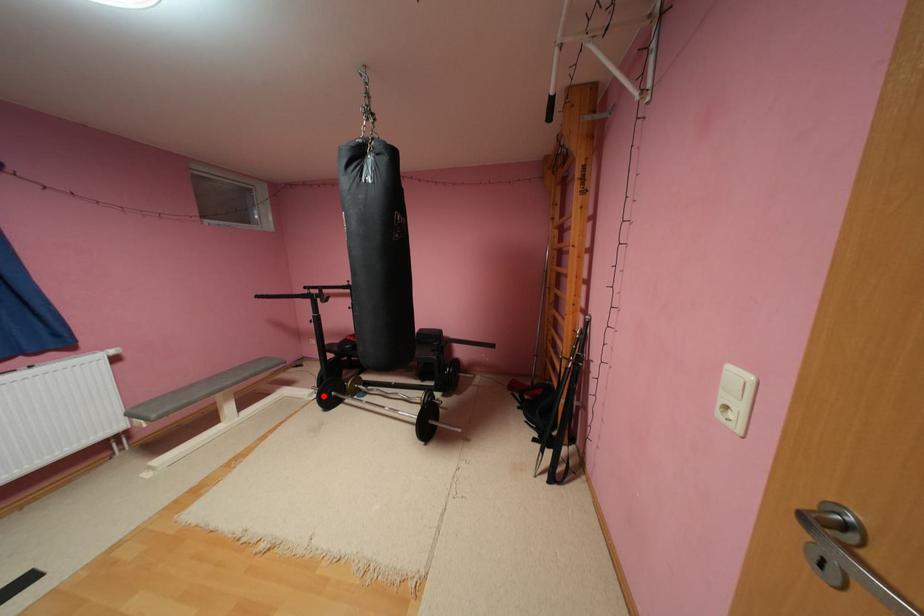
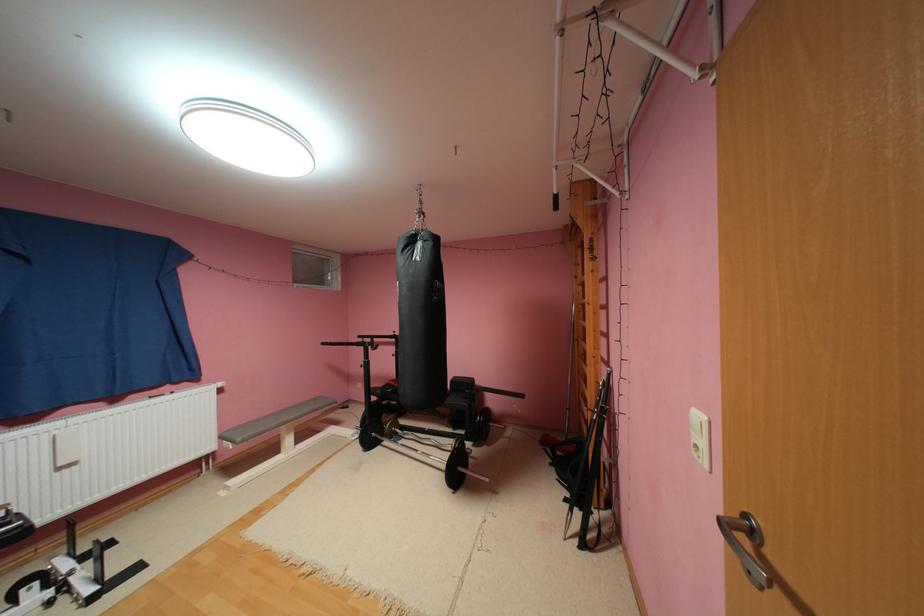
Question: I am providing you with two images of the same scene from different viewpoints. Image1 has a red point marked. In image2, the corresponding 3D location appears at what relative position? Reply with the corresponding letter.

Choices:
 (A) Closer
 (B) Farther

Answer: (A)